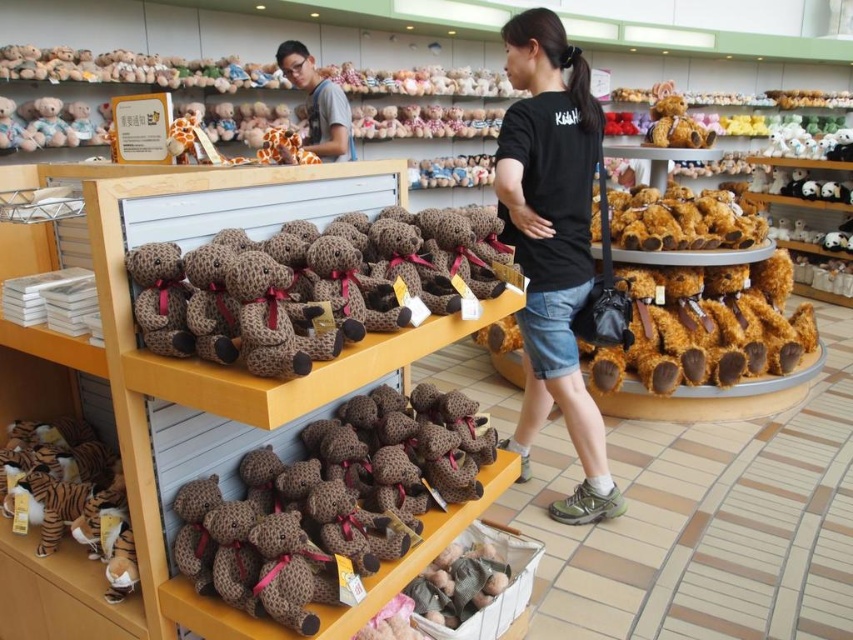
You are a customer in the toy store looking at the brown plush bear at center and the leopard print plush bear at center. Which bear is positioned to the right side?

The brown plush bear at center is to the right of the leopard print plush bear at center.